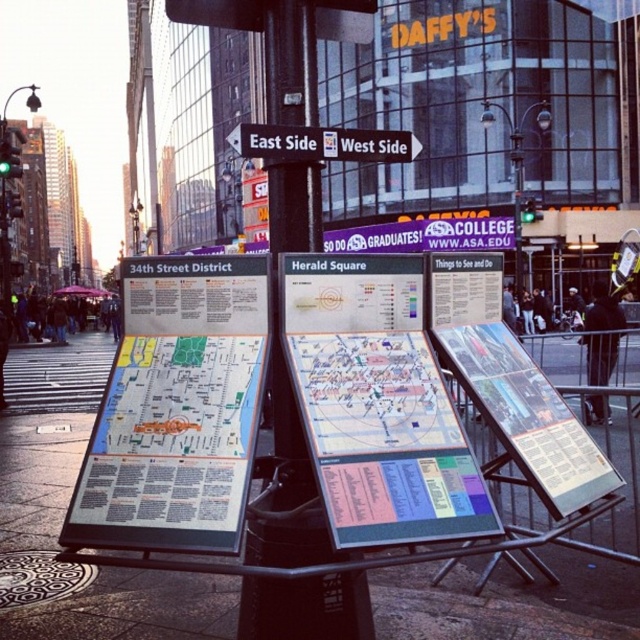
Is white paper map at center wider than blue plastic sign at center?

In fact, white paper map at center might be narrower than blue plastic sign at center.

Who is positioned more to the left, white paper map at center or blue plastic sign at center?

Positioned to the left is white paper map at center.

Does point (227, 330) lie in front of point (435, 228)?

Yes, it is in front of point (435, 228).

The width and height of the screenshot is (640, 640). In order to click on white paper map at center in this screenshot , I will do click(177, 410).

Is smooth concrete pavement at center taller than white plastic street sign at center?

No, smooth concrete pavement at center is not taller than white plastic street sign at center.

Does point (438, 609) come behind point (298, 147)?

Yes, point (438, 609) is behind point (298, 147).

The height and width of the screenshot is (640, 640). What are the coordinates of `smooth concrete pavement at center` in the screenshot? It's located at (64, 513).

Is point (337, 140) positioned in front of point (371, 243)?

Yes, it is in front of point (371, 243).

Does white plastic street sign at center have a smaller size compared to blue plastic sign at center?

Indeed, white plastic street sign at center has a smaller size compared to blue plastic sign at center.

Is point (368, 161) farther from viewer compared to point (412, 220)?

No.

The height and width of the screenshot is (640, 640). I want to click on white plastic street sign at center, so click(x=323, y=144).